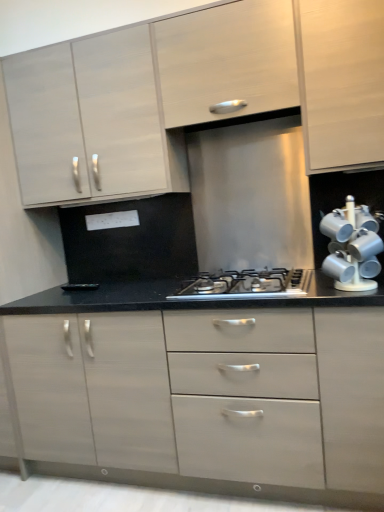
Question: Is matte white cabinet at upper center, the third cabinetry when ordered from bottom to top, taller than white glossy mug rack at right?

Choices:
 (A) yes
 (B) no

Answer: (A)

Question: Is matte white cabinet at upper center, the third cabinetry when ordered from bottom to top, further to camera compared to white glossy mug rack at right?

Choices:
 (A) no
 (B) yes

Answer: (B)

Question: Is matte white cabinet at upper center, the third cabinetry when ordered from bottom to top, not inside white glossy mug rack at right?

Choices:
 (A) no
 (B) yes

Answer: (B)

Question: Are matte white cabinet at upper center, which is the 1th cabinetry from top to bottom, and white glossy mug rack at right making contact?

Choices:
 (A) no
 (B) yes

Answer: (A)

Question: Does matte white cabinet at upper center, which is the 1th cabinetry from top to bottom, turn towards white glossy mug rack at right?

Choices:
 (A) yes
 (B) no

Answer: (B)

Question: Is matte white cabinet at upper left, acting as the second cabinetry starting from the bottom, inside or outside of matte white cabinet at upper center, the third cabinetry when ordered from bottom to top?

Choices:
 (A) outside
 (B) inside

Answer: (A)

Question: Would you say matte white cabinet at upper left, acting as the second cabinetry starting from the bottom, is to the left or to the right of matte white cabinet at upper center, which is the 1th cabinetry from top to bottom, in the picture?

Choices:
 (A) left
 (B) right

Answer: (A)

Question: Considering their positions, is matte white cabinet at upper left, acting as the second cabinetry starting from the bottom, located in front of or behind matte white cabinet at upper center, the third cabinetry when ordered from bottom to top?

Choices:
 (A) front
 (B) behind

Answer: (B)

Question: In terms of width, does matte white cabinet at upper left, which appears as the second cabinetry when viewed from the top, look wider or thinner when compared to matte white cabinet at upper center, the third cabinetry when ordered from bottom to top?

Choices:
 (A) thin
 (B) wide

Answer: (B)

Question: In terms of height, does satin silver gas stove at center look taller or shorter compared to matte white cabinet at upper center, the third cabinetry when ordered from bottom to top?

Choices:
 (A) short
 (B) tall

Answer: (A)

Question: In terms of size, does satin silver gas stove at center appear bigger or smaller than matte white cabinet at upper center, which is the 1th cabinetry from top to bottom?

Choices:
 (A) big
 (B) small

Answer: (B)

Question: Is satin silver gas stove at center to the left or to the right of matte white cabinet at upper center, which is the 1th cabinetry from top to bottom, in the image?

Choices:
 (A) right
 (B) left

Answer: (A)

Question: Is satin silver gas stove at center in front of or behind matte white cabinet at upper center, the third cabinetry when ordered from bottom to top, in the image?

Choices:
 (A) front
 (B) behind

Answer: (A)

Question: Considering the positions of white glossy mug rack at right and matte white cabinet at upper left, which appears as the second cabinetry when viewed from the top, in the image, is white glossy mug rack at right wider or thinner than matte white cabinet at upper left, which appears as the second cabinetry when viewed from the top,?

Choices:
 (A) wide
 (B) thin

Answer: (B)

Question: Is white glossy mug rack at right bigger or smaller than matte white cabinet at upper left, acting as the second cabinetry starting from the bottom?

Choices:
 (A) small
 (B) big

Answer: (A)